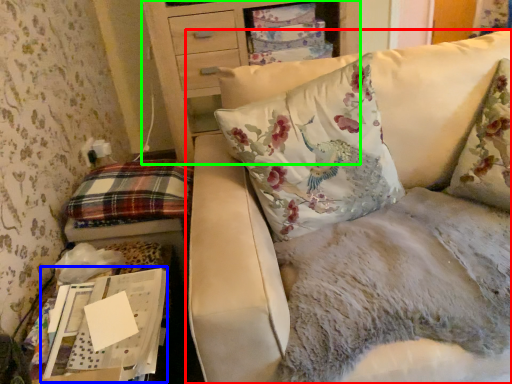
Question: Which object is the farthest from studio couch (highlighted by a red box)? Choose among these: cardboard box (highlighted by a blue box) or furniture (highlighted by a green box).

Choices:
 (A) cardboard box
 (B) furniture

Answer: (B)